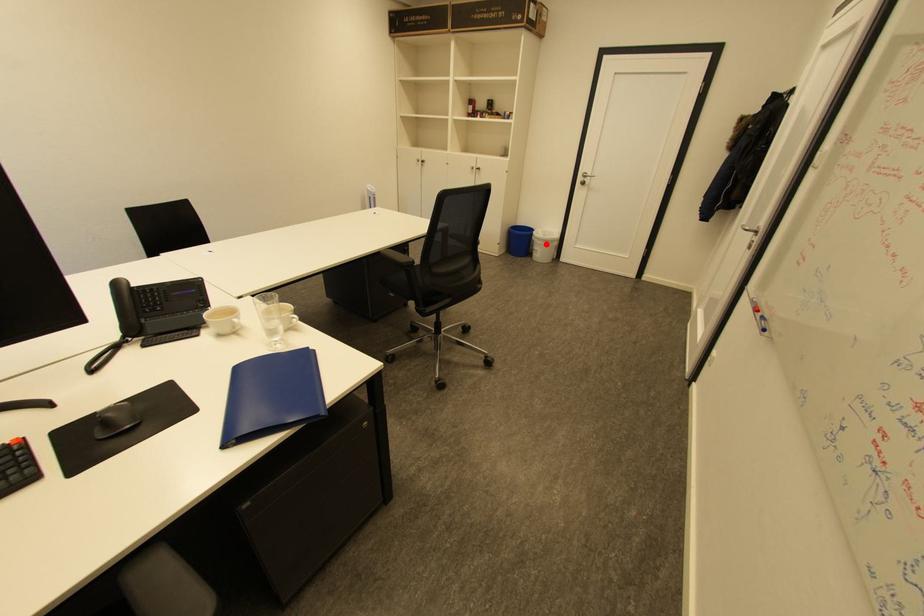
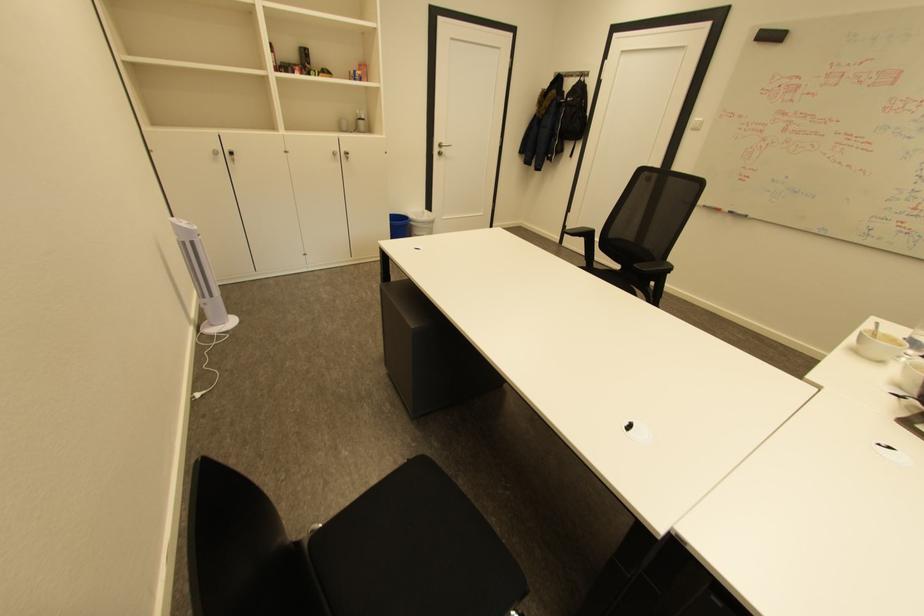
Find the pixel in the second image that matches the highlighted location in the first image.

(432, 227)